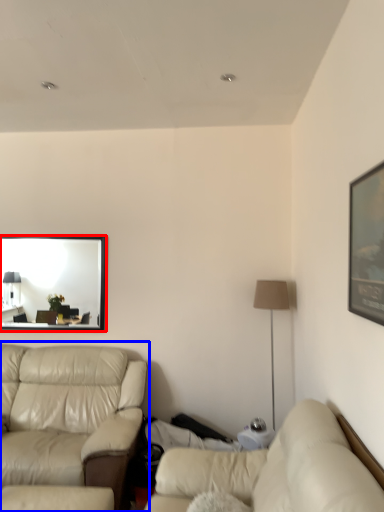
Question: Among these objects, which one is farthest to the camera, mirror (highlighted by a red box) or studio couch (highlighted by a blue box)?

Choices:
 (A) mirror
 (B) studio couch

Answer: (A)